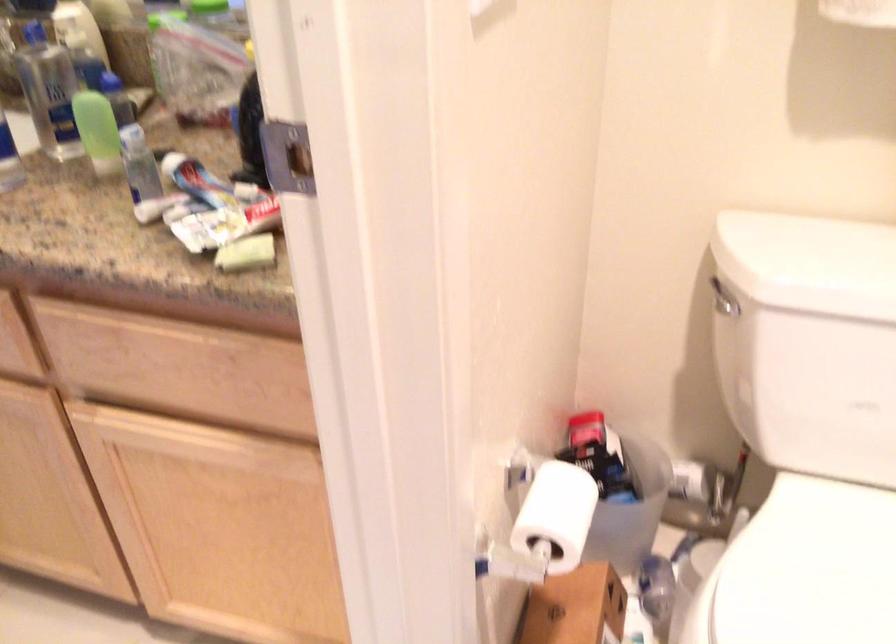
Identify the location of toilet flush handle. (724, 299).